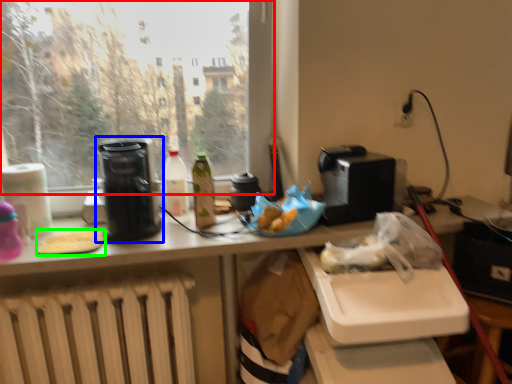
Question: Which is farther away from window (highlighted by a red box)? kitchen appliance (highlighted by a blue box) or food (highlighted by a green box)?

Choices:
 (A) kitchen appliance
 (B) food

Answer: (B)